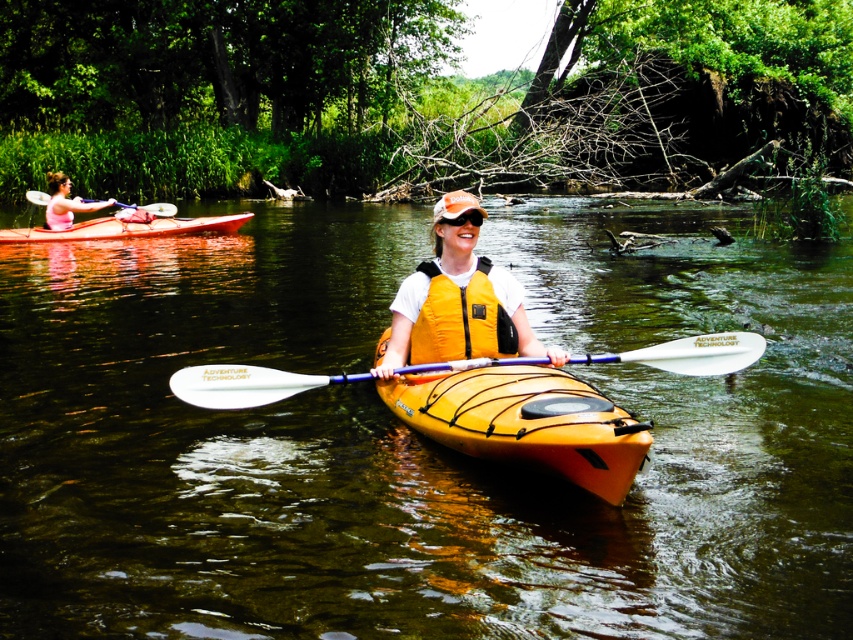
Is point (225, 403) positioned before point (469, 209)?

That is True.

Does white plastic paddle at center appear on the left side of orange matte goggles at center?

In fact, white plastic paddle at center is to the right of orange matte goggles at center.

This screenshot has height=640, width=853. What are the coordinates of `white plastic paddle at center` in the screenshot? It's located at (245, 385).

Is point (392, 614) closer to camera compared to point (569, 477)?

Yes, point (392, 614) is in front of point (569, 477).

The width and height of the screenshot is (853, 640). I want to click on yellow kayak at center, so click(416, 438).

Is point (134, 241) farther from camera compared to point (598, 433)?

Yes, it is.

Find the location of a particular element. This screenshot has height=640, width=853. yellow kayak at center is located at coordinates (416, 438).

Is point (115, 234) farther from viewer compared to point (51, 218)?

Yes, it is behind point (51, 218).

Looking at this image, is matte red canoe at left wider than pink fabric kayak at upper left?

Yes.

Between point (80, 228) and point (51, 216), which one is positioned in front?

Point (51, 216) is more forward.

Where is `matte red canoe at left`? matte red canoe at left is located at coordinates (125, 228).